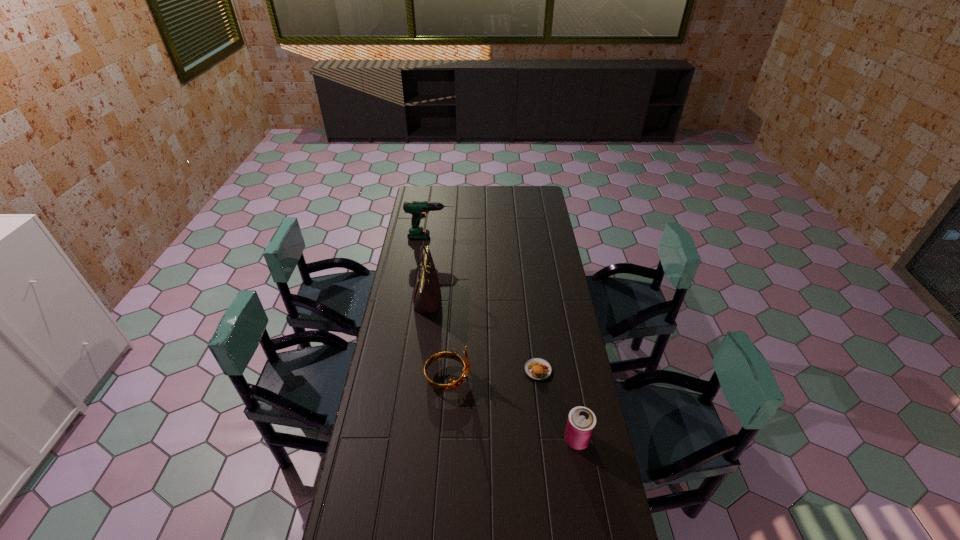
Find the location of `vacant space at the right edge of the desktop`. vacant space at the right edge of the desktop is located at coordinates (562, 460).

This screenshot has height=540, width=960. In the image, there is a desktop. What are the coordinates of `vacant space at the far left corner` in the screenshot? It's located at (425, 195).

You are a GUI agent. You are given a task and a screenshot of the screen. Output one action in this format:
    pyautogui.click(x=<x>, y=<y>)
    Task: Click on the vacant space at the far right corner of the desktop
    The width and height of the screenshot is (960, 540).
    Given the screenshot: What is the action you would take?
    pyautogui.click(x=530, y=205)

Find the location of a particular element. This screenshot has width=960, height=540. free space between the patty and the tallest object is located at coordinates (482, 334).

Locate an element on the screen. This screenshot has height=540, width=960. blank region between the tiara and the handbag is located at coordinates (438, 339).

At what (x,y) coordinates should I click in order to perform the action: click on empty location between the rightmost object and the farthest object. Please return your answer as a coordinate pair (x, y). This screenshot has width=960, height=540. Looking at the image, I should click on (504, 338).

Identify the location of vacant region between the nearest object and the second farthest object. The image size is (960, 540). (502, 369).

Locate an element on the screen. The width and height of the screenshot is (960, 540). free point between the shortest object and the farthest object is located at coordinates (485, 303).

Image resolution: width=960 pixels, height=540 pixels. Find the location of `vacant space that is in between the third tallest object and the handbag`. vacant space that is in between the third tallest object and the handbag is located at coordinates (438, 339).

Locate which object is the third closest to the third tallest object. Please provide its 2D coordinates. Your answer should be formatted as a tuple, i.e. [(x, y)], where the tuple contains the x and y coordinates of a point satisfying the conditions above.

[(581, 422)]